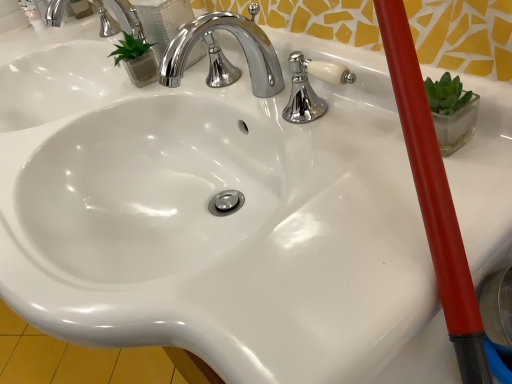
The image size is (512, 384). Identify the location of free space that is to the left of polished chrome faucet at upper center, which is the first tap from back to front. (54, 42).